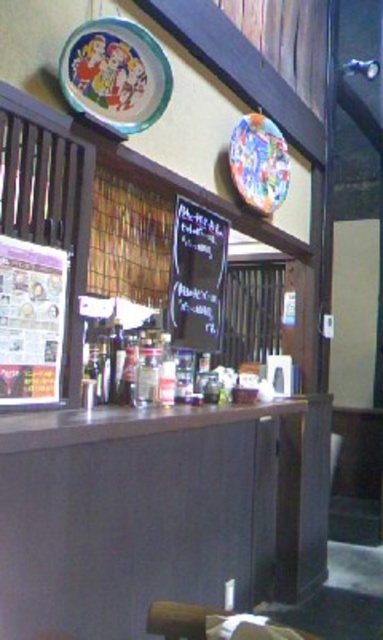
Question: Can you confirm if smooth dark wood table at center is positioned to the left of matte ceramic plate at upper left?

Choices:
 (A) yes
 (B) no

Answer: (B)

Question: Among these points, which one is nearest to the camera?

Choices:
 (A) tap(261, 195)
 (B) tap(194, 252)
 (C) tap(224, 408)

Answer: (C)

Question: Where is black chalkboard at center located in relation to colorful glossy plate at upper center in the image?

Choices:
 (A) above
 (B) below

Answer: (B)

Question: Does matte ceramic plate at upper left have a lesser width compared to black chalkboard at center?

Choices:
 (A) yes
 (B) no

Answer: (B)

Question: Estimate the real-world distances between objects in this image. Which object is closer to the black chalkboard at center?

Choices:
 (A) colorful glossy plate at upper center
 (B) matte ceramic plate at upper left

Answer: (A)

Question: Which object is positioned farthest from the colorful glossy plate at upper center?

Choices:
 (A) black chalkboard at center
 (B) smooth dark wood table at center
 (C) matte ceramic plate at upper left

Answer: (B)